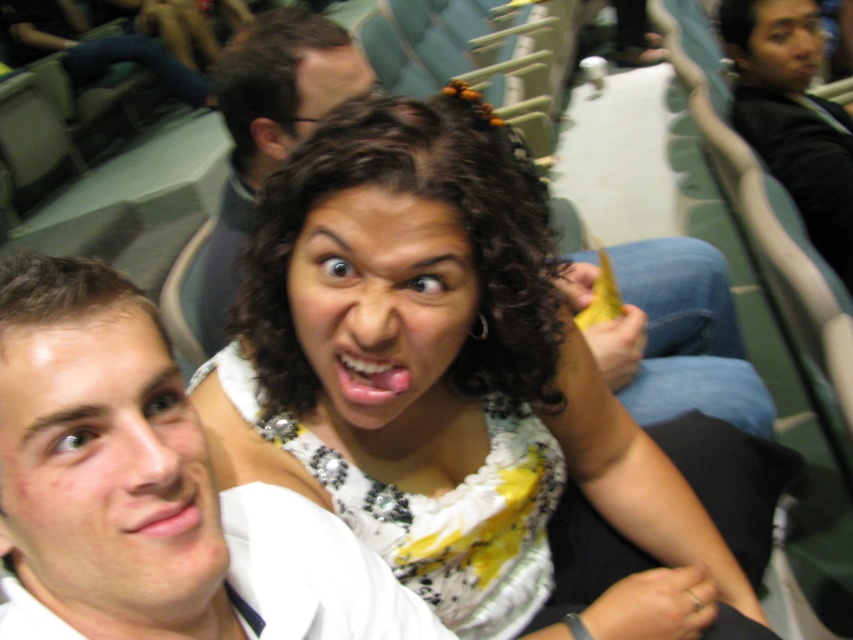
Question: Among these points, which one is nearest to the camera?

Choices:
 (A) (397, 248)
 (B) (822, 51)
 (C) (370, 170)
 (D) (376, 563)

Answer: (C)

Question: Does white shirt at center appear over smooth skin face at left?

Choices:
 (A) no
 (B) yes

Answer: (A)

Question: Estimate the real-world distances between objects in this image. Which object is farther from the smooth skin face at left?

Choices:
 (A) matte white blouse at center
 (B) smooth skin face at upper right

Answer: (B)

Question: Does smooth skin face at left appear on the right side of black sweater at upper right?

Choices:
 (A) no
 (B) yes

Answer: (A)

Question: Can you confirm if white shirt at center is positioned to the left of matte white blouse at center?

Choices:
 (A) no
 (B) yes

Answer: (B)

Question: Estimate the real-world distances between objects in this image. Which object is closer to the smooth skin face at upper right?

Choices:
 (A) black sweater at upper right
 (B) white shirt at center
 (C) matte white blouse at center
 (D) white floral dress at center

Answer: (A)